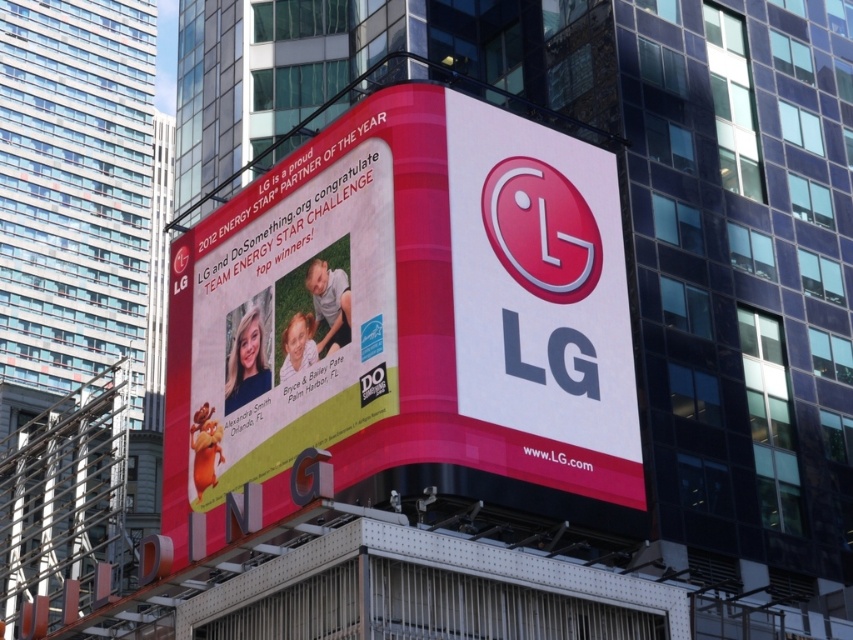
This screenshot has height=640, width=853. Describe the element at coordinates (404, 314) in the screenshot. I see `matte plastic billboard at center` at that location.

How much distance is there between matte plastic billboard at center and matte pink banner at center?

matte plastic billboard at center and matte pink banner at center are 1.11 meters apart from each other.

This screenshot has width=853, height=640. What do you see at coordinates (404, 314) in the screenshot? I see `matte plastic billboard at center` at bounding box center [404, 314].

Identify the location of matte plastic billboard at center. (404, 314).